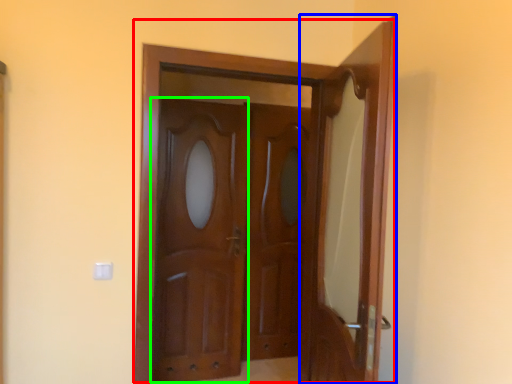
Question: Considering the real-world distances, which object is farthest from door (highlighted by a red box)? door (highlighted by a blue box) or barn door (highlighted by a green box)?

Choices:
 (A) door
 (B) barn door

Answer: (B)